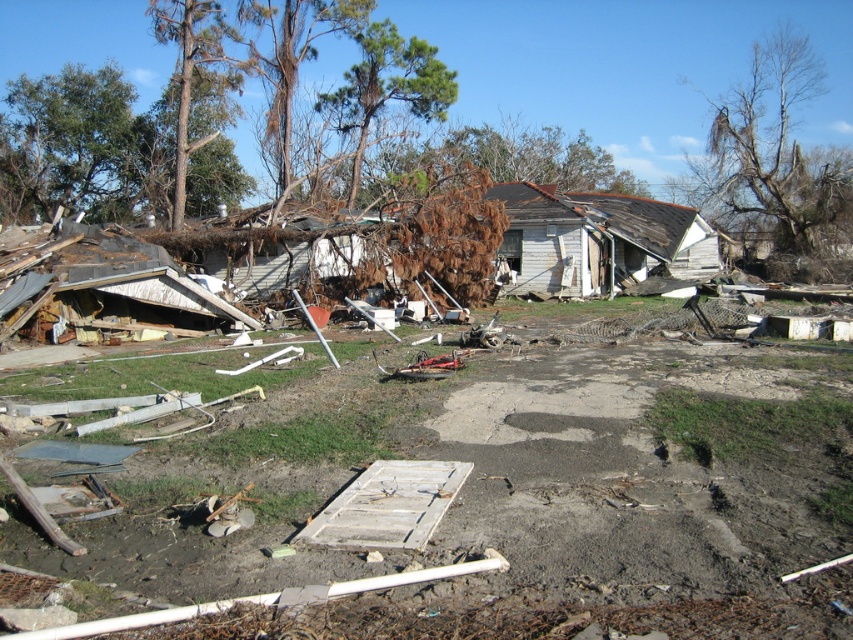
Which is in front, point (421, 74) or point (183, 202)?

Point (183, 202)

Where is `brown/dried wood tree at upper center`? brown/dried wood tree at upper center is located at coordinates pos(387,88).

Is brown/dry wood tree at upper left taller than brown textured tree at upper left?

Incorrect, brown/dry wood tree at upper left's height is not larger of brown textured tree at upper left's.

This screenshot has width=853, height=640. I want to click on brown/dry wood tree at upper left, so click(x=67, y=144).

Which is behind, point (125, 211) or point (216, 4)?

The point (125, 211) is more distant.

Where is `brown/dry wood tree at upper left`? Image resolution: width=853 pixels, height=640 pixels. brown/dry wood tree at upper left is located at coordinates (67, 144).

The image size is (853, 640). In order to click on bare wood tree at upper right in this screenshot , I will do `click(778, 166)`.

Is bare wood tree at upper right above brown textured tree at upper left?

Indeed, bare wood tree at upper right is positioned over brown textured tree at upper left.

Does point (726, 188) come behind point (184, 17)?

Yes, point (726, 188) is farther from viewer.

Where is `bare wood tree at upper right`? This screenshot has width=853, height=640. bare wood tree at upper right is located at coordinates (778, 166).